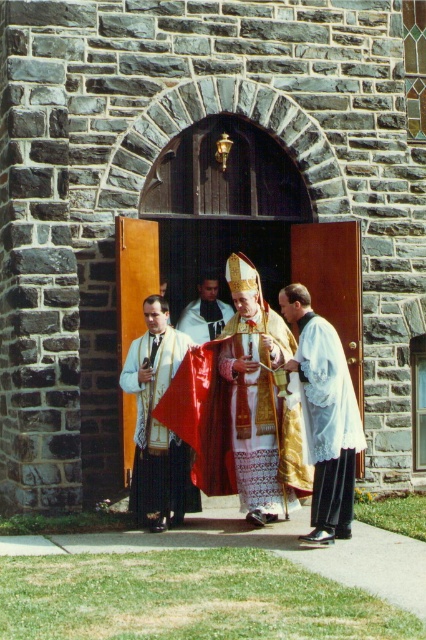
You are a photographer positioned at the front of the church, and you want to capture both the white lace robe at right and the white silk robe at center in your shot. Which robe will appear taller in the photo?

The white lace robe at right is taller than the white silk robe at center, so it will appear taller in the photo.

You are a photographer positioned in front of the church and want to capture both the white textured vestment at center and the white silk robe at center in a single photo. Which object should you adjust your camera angle to focus on first to ensure both are in frame?

The white textured vestment at center is to the left of the white silk robe at center, so you should focus on the white silk robe at center first to ensure both are captured in the frame.

From the picture: You are standing in front of the church and see two points marked in the scene. Which point is closer to you, point (339, 484) or point (195, 305)?

Point (339, 484) is closer to the viewer than point (195, 305).